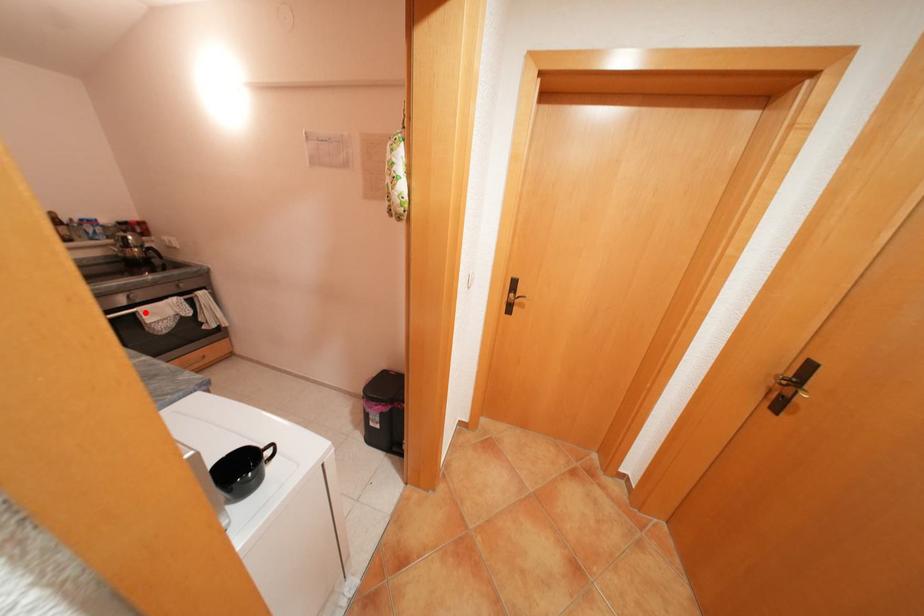
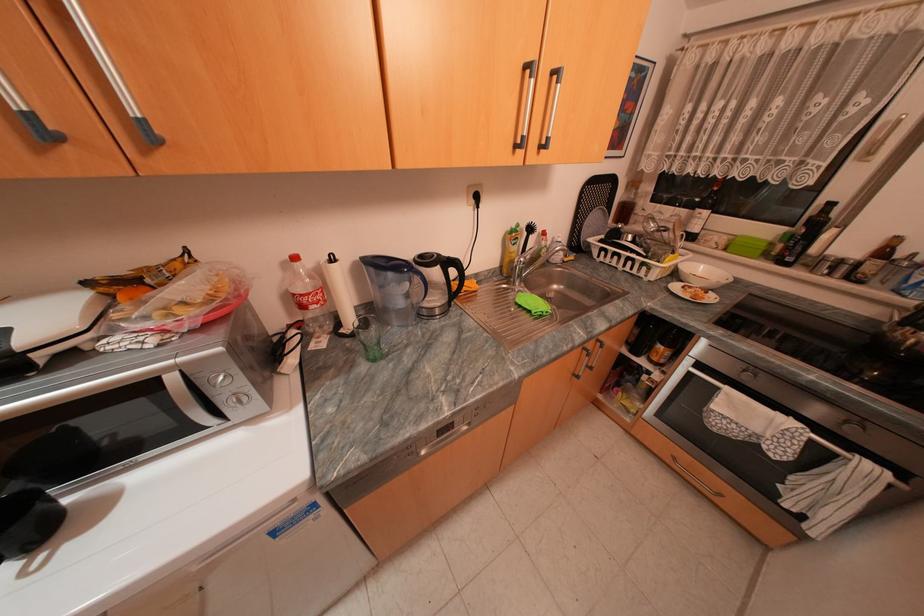
Find the pixel in the second image that matches the highlighted location in the first image.

(727, 389)